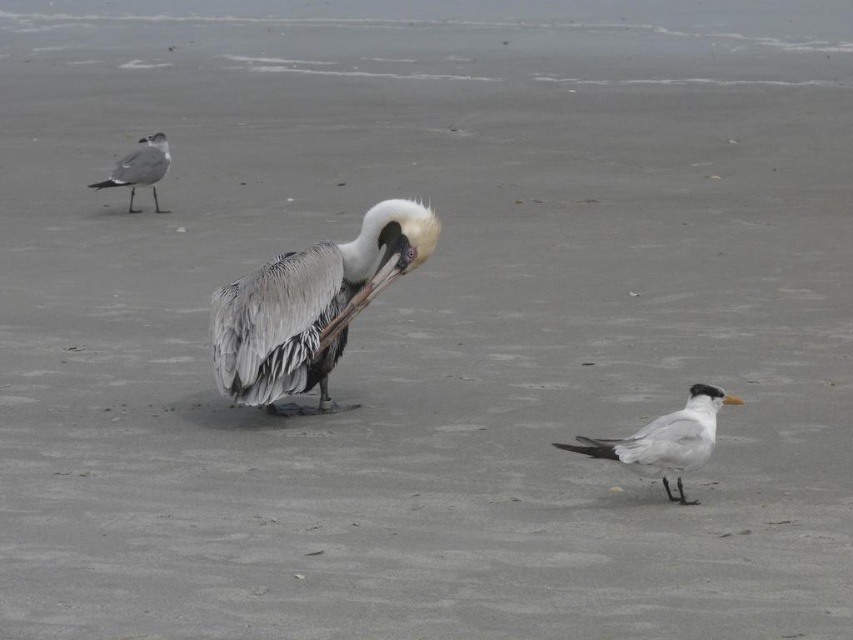
Looking at this image, can you confirm if gray feathered pelican at center is positioned above yellow beak bird at lower right?

Indeed, gray feathered pelican at center is positioned over yellow beak bird at lower right.

Can you confirm if gray feathered pelican at center is smaller than yellow beak bird at lower right?

No.

Is point (296, 323) in front of point (634, 449)?

No, (296, 323) is behind (634, 449).

You are a GUI agent. You are given a task and a screenshot of the screen. Output one action in this format:
    pyautogui.click(x=<x>, y=<y>)
    Task: Click on the gray feathered pelican at center
    The image size is (853, 640).
    Given the screenshot: What is the action you would take?
    pyautogui.click(x=310, y=305)

Is point (294, 344) closer to camera compared to point (142, 168)?

Yes, it is in front of point (142, 168).

Can you confirm if gray feathered pelican at center is wider than gray matte seagull at upper left?

Yes, gray feathered pelican at center is wider than gray matte seagull at upper left.

Which is behind, point (241, 397) or point (149, 145)?

Point (149, 145)

You are a GUI agent. You are given a task and a screenshot of the screen. Output one action in this format:
    pyautogui.click(x=<x>, y=<y>)
    Task: Click on the gray feathered pelican at center
    This screenshot has height=640, width=853.
    Given the screenshot: What is the action you would take?
    310,305

Is yellow beak bird at lower right to the left of gray matte seagull at upper left from the viewer's perspective?

No, yellow beak bird at lower right is not to the left of gray matte seagull at upper left.

Does yellow beak bird at lower right have a larger size compared to gray matte seagull at upper left?

No, yellow beak bird at lower right is not bigger than gray matte seagull at upper left.

Does point (668, 468) lie in front of point (109, 173)?

Yes.

This screenshot has height=640, width=853. I want to click on yellow beak bird at lower right, so (x=670, y=440).